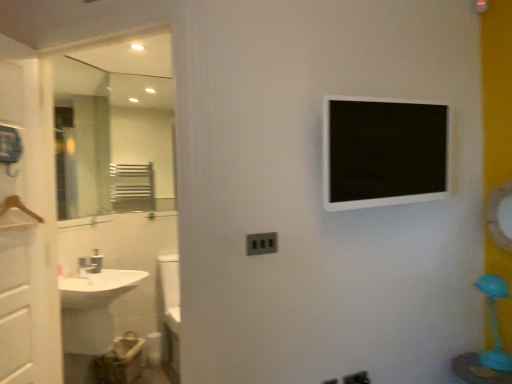
Question: Does white glossy sink at lower left touch white glossy medicine cabinet at upper center?

Choices:
 (A) yes
 (B) no

Answer: (B)

Question: From the image's perspective, is white glossy sink at lower left over white glossy medicine cabinet at upper center?

Choices:
 (A) yes
 (B) no

Answer: (B)

Question: From the image's perspective, is white glossy sink at lower left below white glossy medicine cabinet at upper center?

Choices:
 (A) no
 (B) yes

Answer: (B)

Question: Would you say white glossy sink at lower left is a long distance from white glossy medicine cabinet at upper center?

Choices:
 (A) yes
 (B) no

Answer: (A)

Question: Is white glossy sink at lower left wider than white glossy medicine cabinet at upper center?

Choices:
 (A) yes
 (B) no

Answer: (A)

Question: Is glossy metallic mirror at upper right in front of or behind white glossy sink at lower left in the image?

Choices:
 (A) behind
 (B) front

Answer: (B)

Question: Looking at their shapes, would you say glossy metallic mirror at upper right is wider or thinner than white glossy sink at lower left?

Choices:
 (A) thin
 (B) wide

Answer: (A)

Question: From the image's perspective, relative to white glossy sink at lower left, is glossy metallic mirror at upper right above or below?

Choices:
 (A) below
 (B) above

Answer: (B)

Question: From a real-world perspective, is glossy metallic mirror at upper right positioned above or below white glossy sink at lower left?

Choices:
 (A) above
 (B) below

Answer: (A)

Question: From a real-world perspective, is white glossy sink at lower left positioned above or below white glossy medicine cabinet at upper center?

Choices:
 (A) below
 (B) above

Answer: (A)

Question: From the image's perspective, is white glossy sink at lower left located above or below white glossy medicine cabinet at upper center?

Choices:
 (A) below
 (B) above

Answer: (A)

Question: Is white glossy sink at lower left wider or thinner than white glossy medicine cabinet at upper center?

Choices:
 (A) wide
 (B) thin

Answer: (A)

Question: Considering the positions of white glossy sink at lower left and white glossy medicine cabinet at upper center in the image, is white glossy sink at lower left taller or shorter than white glossy medicine cabinet at upper center?

Choices:
 (A) short
 (B) tall

Answer: (B)

Question: Do you think white glossy screen door at left is within matte gray electric outlet at center, or outside of it?

Choices:
 (A) inside
 (B) outside

Answer: (B)

Question: From a real-world perspective, relative to matte gray electric outlet at center, is white glossy screen door at left vertically above or below?

Choices:
 (A) below
 (B) above

Answer: (B)